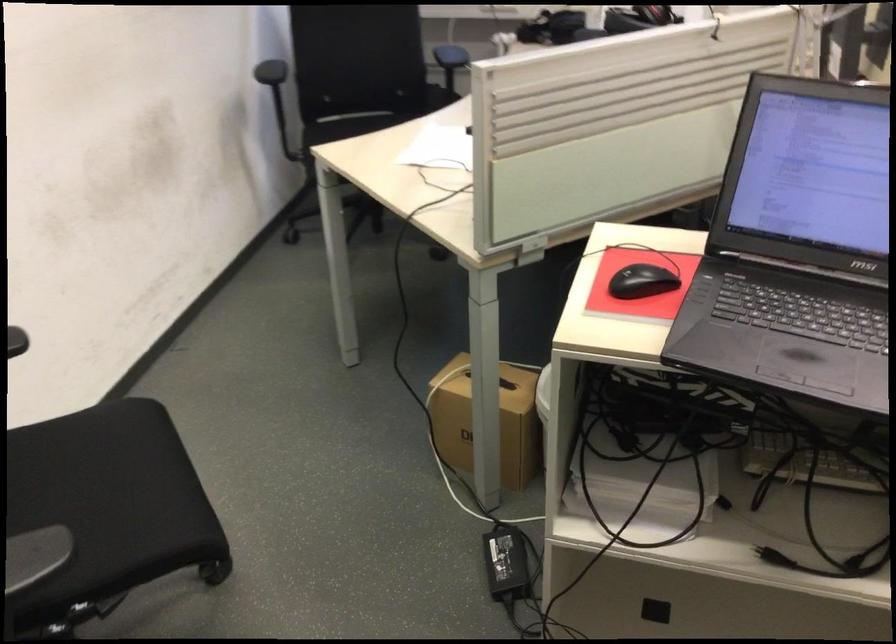
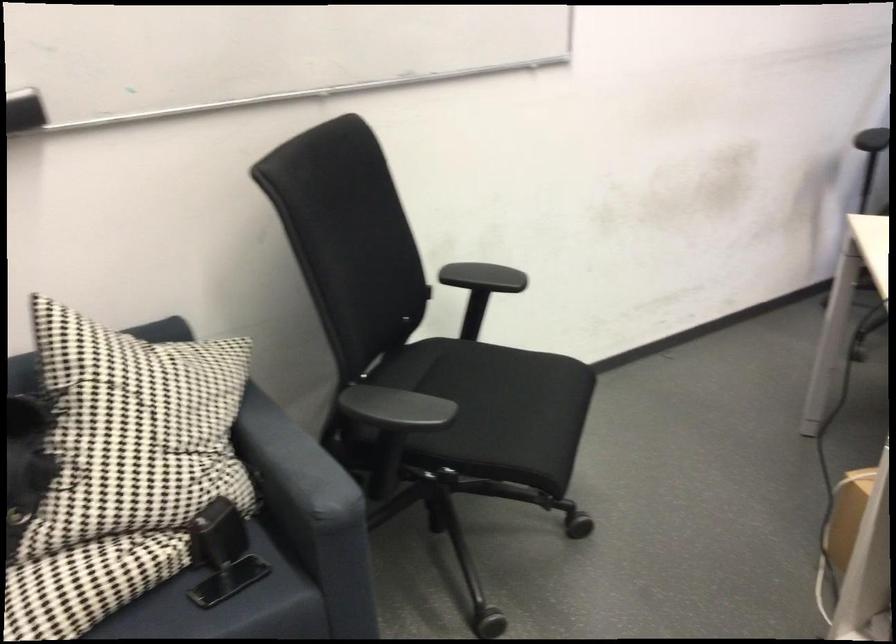
Locate, in the second image, the point that corresponds to the point at 92,515 in the first image.

(495, 409)